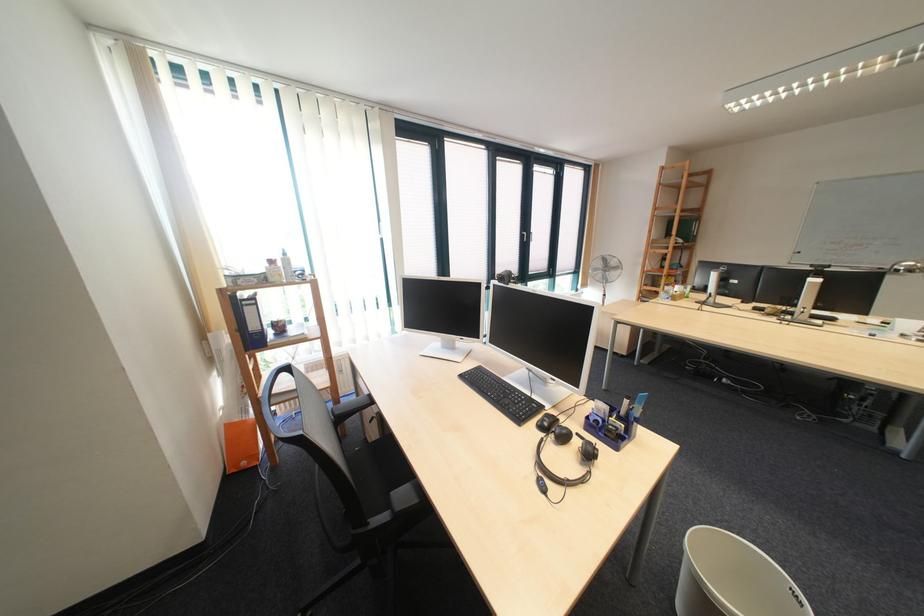
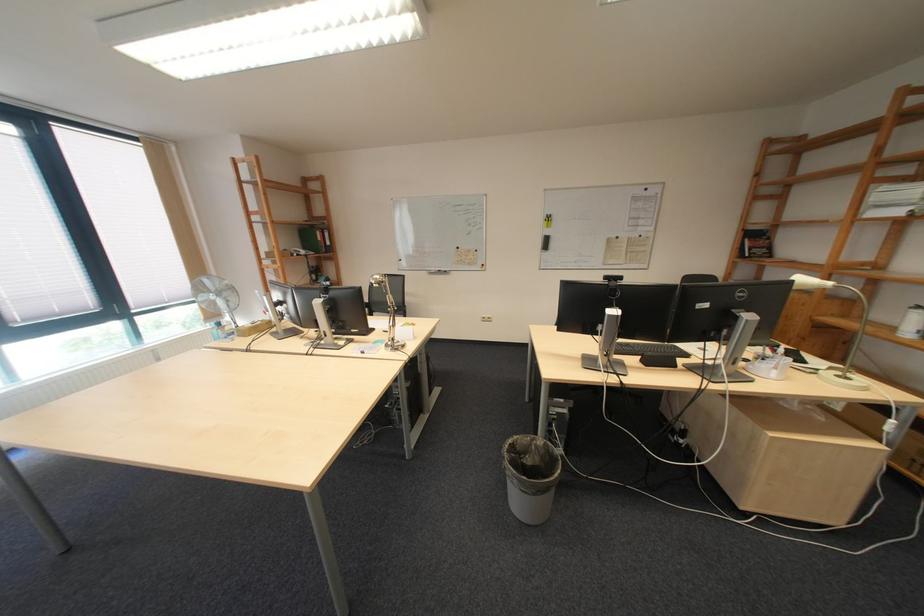
In the second image, find the point that corresponds to point 679,225 in the first image.

(310, 233)